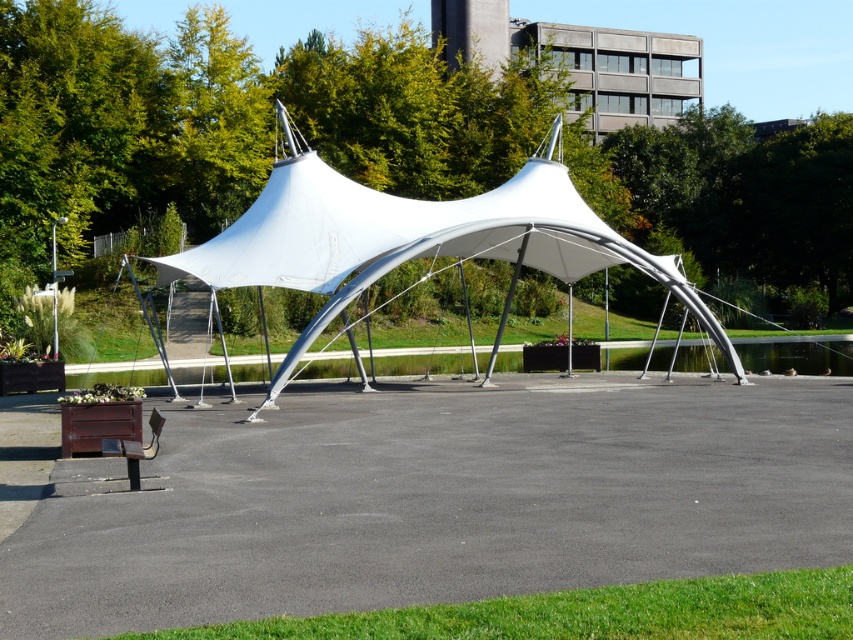
Can you confirm if white fabric tent at center is taller than wooden park bench at lower left?

Indeed, white fabric tent at center has a greater height compared to wooden park bench at lower left.

Which is behind, point (228, 230) or point (160, 413)?

Point (228, 230)

Locate an element on the screen. white fabric tent at center is located at coordinates (412, 240).